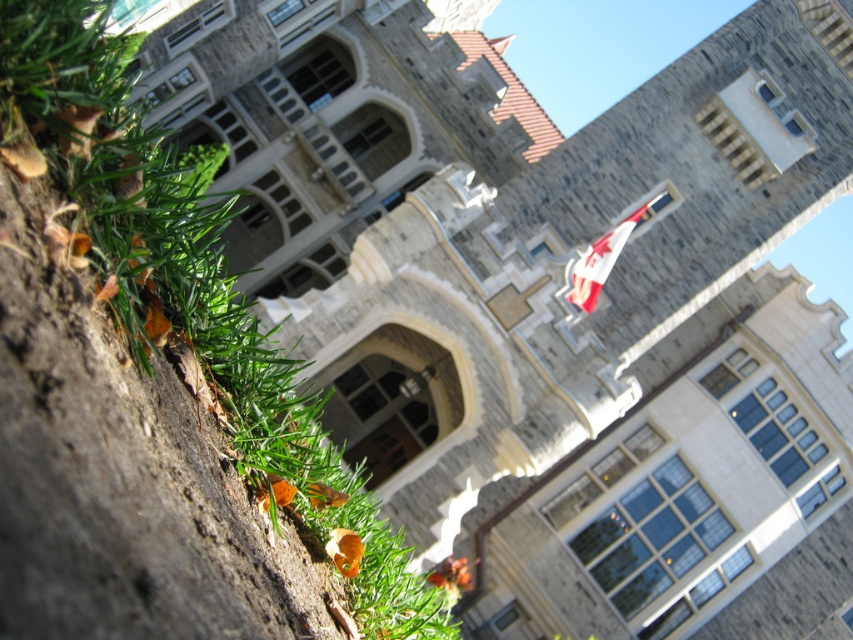
Who is lower down, green grass at lower left or red fabric flag at upper center?

green grass at lower left is below.

Identify the location of green grass at lower left. The width and height of the screenshot is (853, 640). (151, 387).